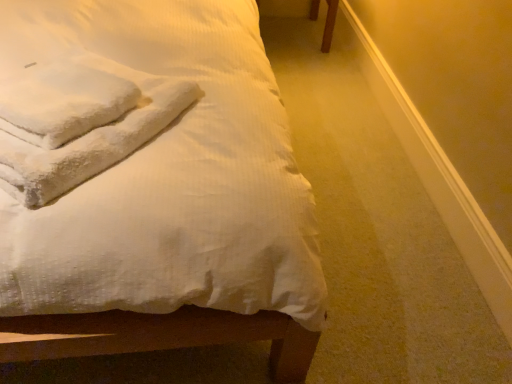
Question: From a real-world perspective, does white fluffy towels at upper left stand above white textured bed at upper left?

Choices:
 (A) yes
 (B) no

Answer: (A)

Question: From the image's perspective, is white fluffy towels at upper left on top of white textured bed at upper left?

Choices:
 (A) no
 (B) yes

Answer: (A)

Question: From a real-world perspective, is white fluffy towels at upper left under white textured bed at upper left?

Choices:
 (A) no
 (B) yes

Answer: (A)

Question: Considering the relative sizes of white fluffy towels at upper left and white textured bed at upper left in the image provided, is white fluffy towels at upper left wider than white textured bed at upper left?

Choices:
 (A) no
 (B) yes

Answer: (A)

Question: Is white fluffy towels at upper left taller than white textured bed at upper left?

Choices:
 (A) no
 (B) yes

Answer: (A)

Question: Is white fluffy towels at upper left shorter than white textured bed at upper left?

Choices:
 (A) no
 (B) yes

Answer: (B)

Question: Would you consider white textured bed at upper left to be distant from white fluffy towels at upper left?

Choices:
 (A) yes
 (B) no

Answer: (B)

Question: Is white textured bed at upper left further to the viewer compared to white fluffy towels at upper left?

Choices:
 (A) no
 (B) yes

Answer: (A)

Question: From the image's perspective, does white textured bed at upper left appear higher than white fluffy towels at upper left?

Choices:
 (A) no
 (B) yes

Answer: (B)

Question: Is white fluffy towels at upper left completely or partially inside white textured bed at upper left?

Choices:
 (A) no
 (B) yes

Answer: (B)

Question: Can you confirm if white textured bed at upper left is thinner than white fluffy towels at upper left?

Choices:
 (A) yes
 (B) no

Answer: (B)

Question: From a real-world perspective, is white textured bed at upper left physically below white fluffy towels at upper left?

Choices:
 (A) no
 (B) yes

Answer: (B)

Question: Is point (308, 322) positioned closer to the camera than point (8, 82)?

Choices:
 (A) closer
 (B) farther

Answer: (A)